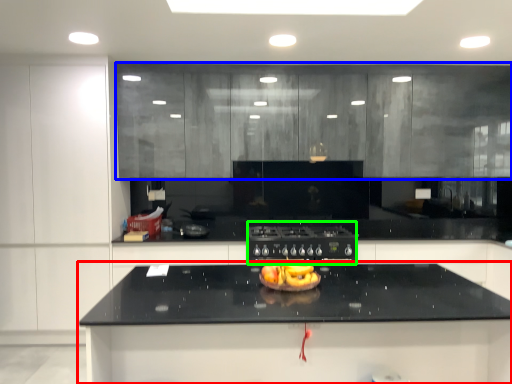
Question: Based on their relative distances, which object is farther from countertop (highlighted by a red box)? Choose from cabinetry (highlighted by a blue box) and appliance (highlighted by a green box).

Choices:
 (A) cabinetry
 (B) appliance

Answer: (A)